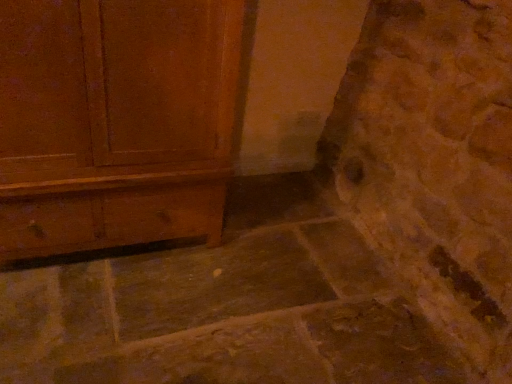
Image resolution: width=512 pixels, height=384 pixels. I want to click on matte wood chest of drawers at left, so click(x=114, y=121).

What do you see at coordinates (114, 121) in the screenshot? I see `matte wood chest of drawers at left` at bounding box center [114, 121].

Locate an element on the screen. matte wood chest of drawers at left is located at coordinates (114, 121).